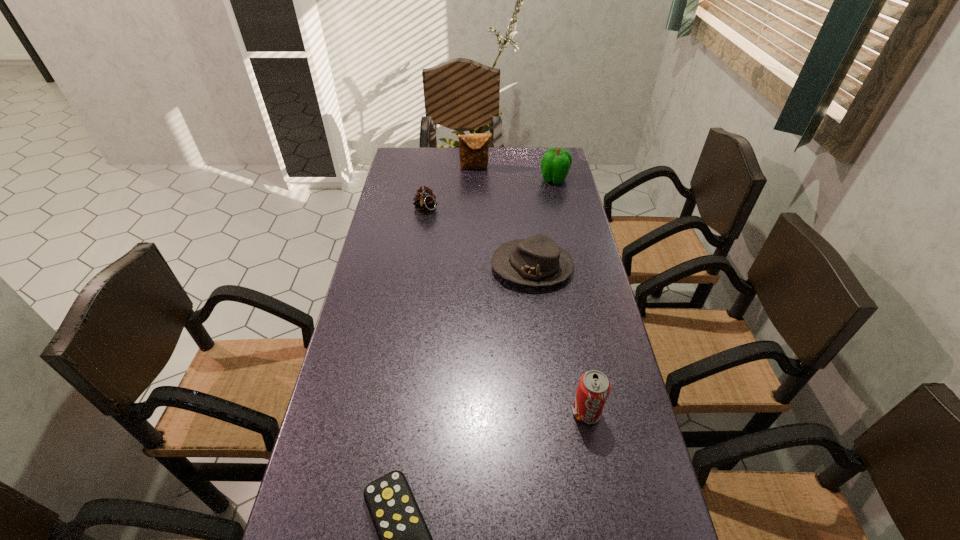
In the image, there is a desktop. Where is `vacant space at the right edge`? vacant space at the right edge is located at coordinates (583, 235).

The image size is (960, 540). In order to click on free space at the far left corner in this screenshot , I will do pyautogui.click(x=431, y=172).

Identify the location of vacant region at the far right corner. (543, 150).

Where is `free space between the soda can and the hat`? The image size is (960, 540). free space between the soda can and the hat is located at coordinates (560, 340).

The width and height of the screenshot is (960, 540). What are the coordinates of `vacant region between the fourth farthest object and the clutch bag` in the screenshot? It's located at (504, 218).

Identify the location of vacant area that lies between the pinecone and the bell pepper. (490, 195).

At what (x,y) coordinates should I click in order to perform the action: click on free space between the hat and the soda can. Please return your answer as a coordinate pair (x, y). The width and height of the screenshot is (960, 540). Looking at the image, I should click on (560, 340).

This screenshot has height=540, width=960. I want to click on vacant area between the bell pepper and the soda can, so click(570, 296).

The width and height of the screenshot is (960, 540). In order to click on empty space that is in between the soda can and the pinecone in this screenshot , I will do tap(506, 311).

Image resolution: width=960 pixels, height=540 pixels. I want to click on free area in between the fourth farthest object and the bell pepper, so click(x=543, y=224).